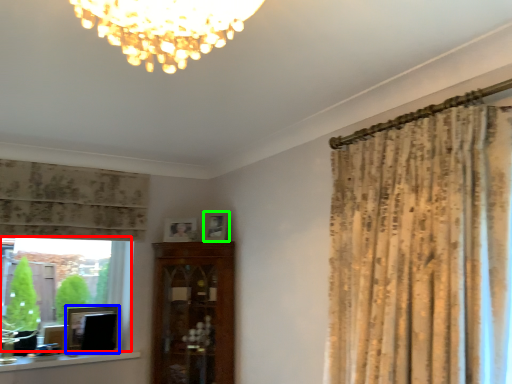
Question: Which object is positioned closest to bay window (highlighted by a red box)? Select from picture frame (highlighted by a blue box) and picture frame (highlighted by a green box).

Choices:
 (A) picture frame
 (B) picture frame

Answer: (A)